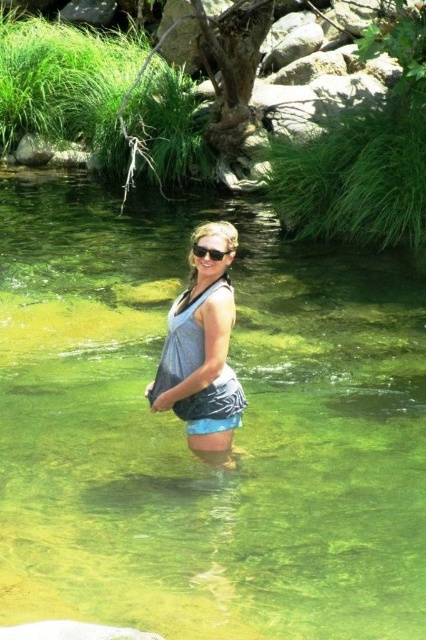
You are a swimmer preparing to enter the water. You have two options for swimwear in the image. Which one is wider between the gray fabric bikini top at center and the matte gray bikini top at center?

The gray fabric bikini top at center is wider than the matte gray bikini top at center according to the description.

You are planning to cross the clear water stream at center while wearing the matte gray bikini top at center. Considering the width of the stream and the top, will you be able to cross without getting the top completely submerged?

The clear water stream at center is wider than the matte gray bikini top at center, so there is enough space to cross without submerging the top completely.